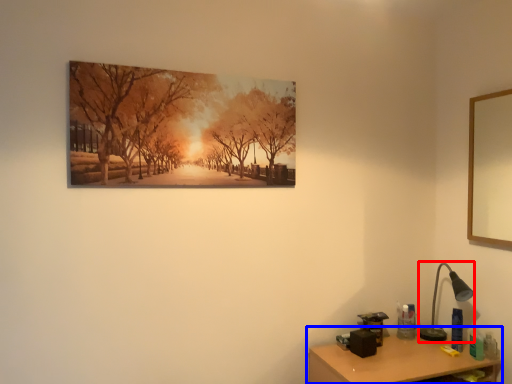
Question: Which object is closer to the camera taking this photo, table lamp (highlighted by a red box) or table (highlighted by a blue box)?

Choices:
 (A) table lamp
 (B) table

Answer: (B)